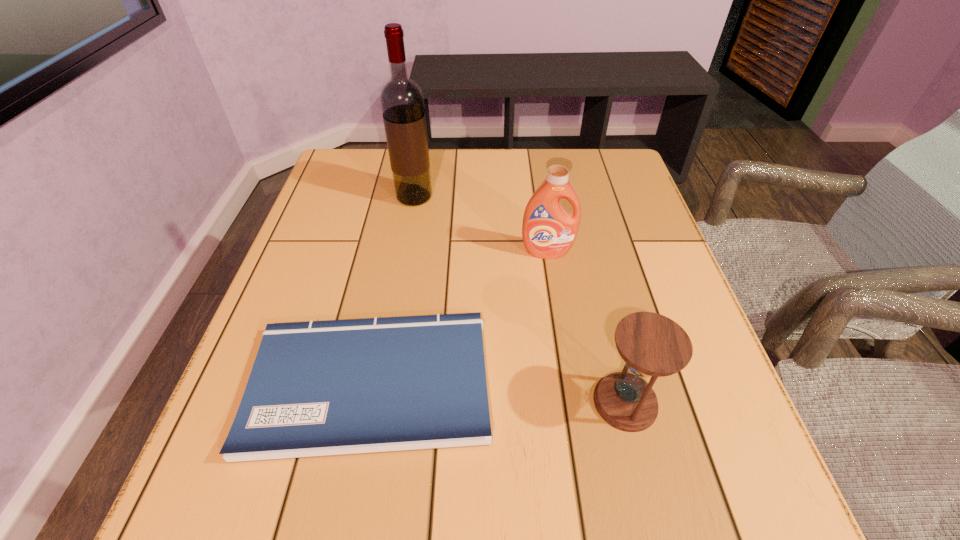
Where is `free location that satisfies the following two spatial constraints: 1. on the front-facing side of the hourglass; 2. on the right side of the second tallest object`? free location that satisfies the following two spatial constraints: 1. on the front-facing side of the hourglass; 2. on the right side of the second tallest object is located at coordinates (570, 402).

The width and height of the screenshot is (960, 540). Find the location of `vacant region that satisfies the following two spatial constraints: 1. on the front side of the third tallest object; 2. on the right side of the shortest object`. vacant region that satisfies the following two spatial constraints: 1. on the front side of the third tallest object; 2. on the right side of the shortest object is located at coordinates (366, 402).